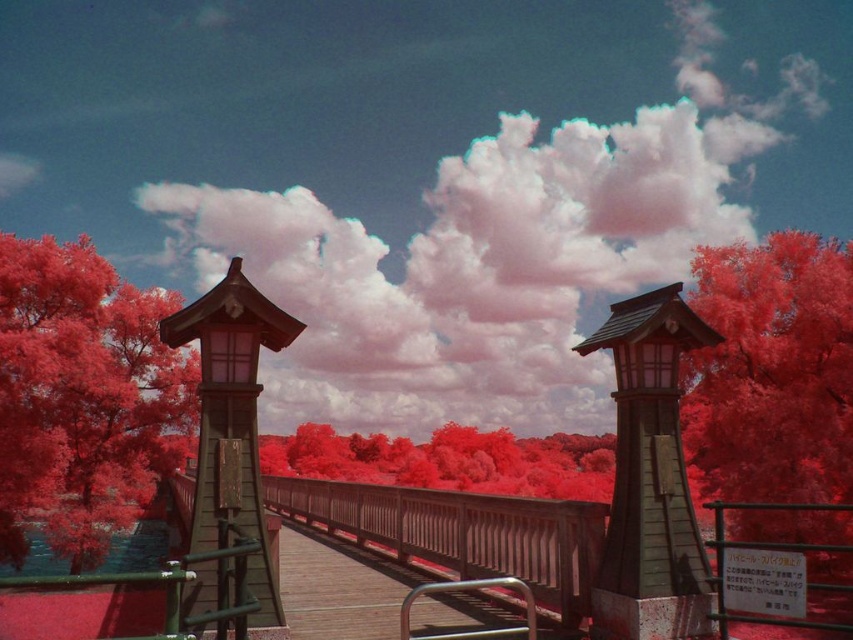
You are standing on the wooden bridge at center and want to locate the wooden bell tower at center. In which direction should you look relative to the bridge?

The wooden bell tower at center is positioned on the right side of wooden bridge at center, so you should look to your right side while standing on the wooden bridge at center to locate it.

You are an artist planning to paint the scene of the wooden bridge surrounded by smooth red trees. You want to ensure the proportions of the trees are accurate. Which tree, the smooth red tree at left or the smooth red tree at center, should you paint with a thicker trunk?

The smooth red tree at center should be painted with a thicker trunk because the smooth red tree at left is thinner than the smooth red tree at center according to the description.